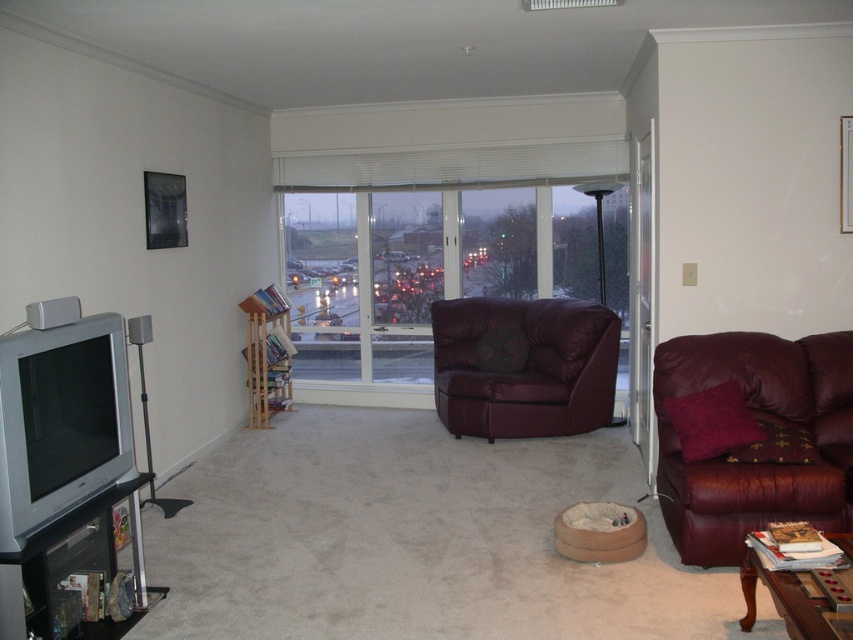
Which is below, transparent glass door at right or wooden coffee table at lower right?

wooden coffee table at lower right is below.

Does transparent glass door at right have a smaller size compared to wooden coffee table at lower right?

No, transparent glass door at right is not smaller than wooden coffee table at lower right.

Who is more forward, (630, 324) or (741, 586)?

Point (741, 586) is more forward.

Identify the location of transparent glass door at right. (642, 294).

Who is more forward, (590, 419) or (115, 561)?

Point (115, 561) is in front.

Between leather armchair at center and matte black tv stand at lower left, which one has more height?

leather armchair at center is taller.

Locate an element on the screen. The width and height of the screenshot is (853, 640). leather armchair at center is located at coordinates (525, 368).

Is point (601, 412) more distant than point (251, 403)?

No, it is in front of (251, 403).

Is leather armchair at center wider than wooden bookshelf at center?

Indeed, leather armchair at center has a greater width compared to wooden bookshelf at center.

Image resolution: width=853 pixels, height=640 pixels. What do you see at coordinates (525, 368) in the screenshot?
I see `leather armchair at center` at bounding box center [525, 368].

Where is `leather armchair at center`? The height and width of the screenshot is (640, 853). leather armchair at center is located at coordinates coord(525,368).